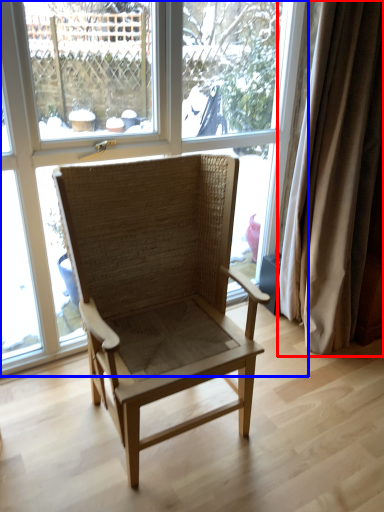
Question: Which object appears farthest to the camera in this image, curtain (highlighted by a red box) or window (highlighted by a blue box)?

Choices:
 (A) curtain
 (B) window

Answer: (A)